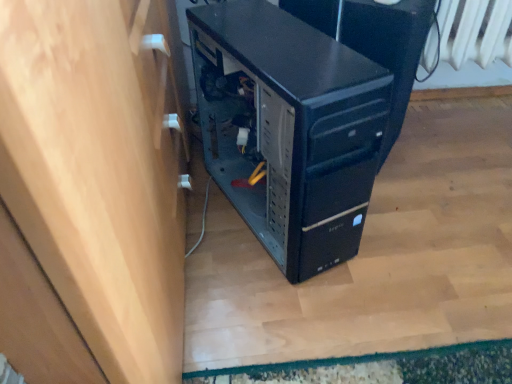
Locate an element on the screen. spots to the right of black plastic computer tower at center is located at coordinates (433, 215).